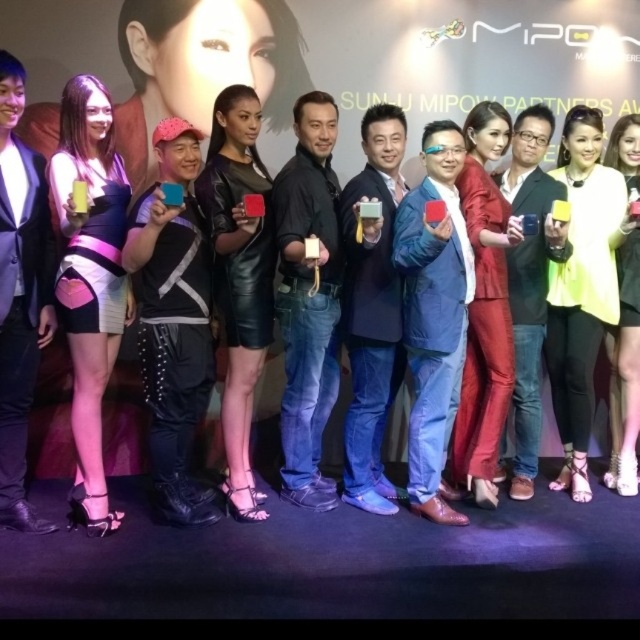
You are a photographer at the event and need to capture a photo where both the black leather jacket at center and the matte black phone at center are visible. Based on their positions, which object should you ensure is placed to the left in your frame?

The black leather jacket at center should be placed to the left in your frame since it is positioned on the left side of the matte black phone at center.

You are a photographer at the event and need to ensure that both the black leather jacket at center and the matte black phone at center are clearly visible in your photo. Given their sizes, which object might require you to adjust your camera angle to avoid being too small in the frame?

The black leather jacket at center is not as tall as the matte black phone at center, so the black leather jacket at center might require adjusting the camera angle to avoid appearing too small in the frame.